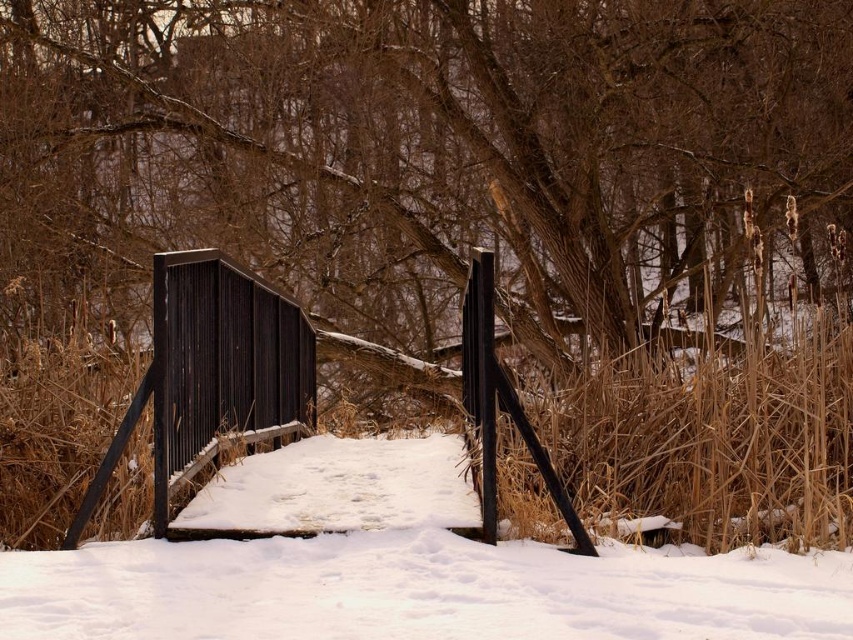
Between brown wood tree at center and white powdery snow at center, which one is positioned higher?

brown wood tree at center

Is brown wood tree at center shorter than white powdery snow at center?

No.

Does point (38, 4) come farther from viewer compared to point (308, 476)?

That is True.

Where is `brown wood tree at center`? The image size is (853, 640). brown wood tree at center is located at coordinates (450, 134).

Identify the location of white powdery snow at center. 402,568.

Who is positioned more to the right, brown wood tree at center or black corrugated metal fence at center?

From the viewer's perspective, brown wood tree at center appears more on the right side.

Does brown wood tree at center have a larger size compared to black corrugated metal fence at center?

Indeed, brown wood tree at center has a larger size compared to black corrugated metal fence at center.

Is point (583, 104) closer to viewer compared to point (148, 374)?

No, (583, 104) is further to viewer.

The height and width of the screenshot is (640, 853). Identify the location of brown wood tree at center. (450, 134).